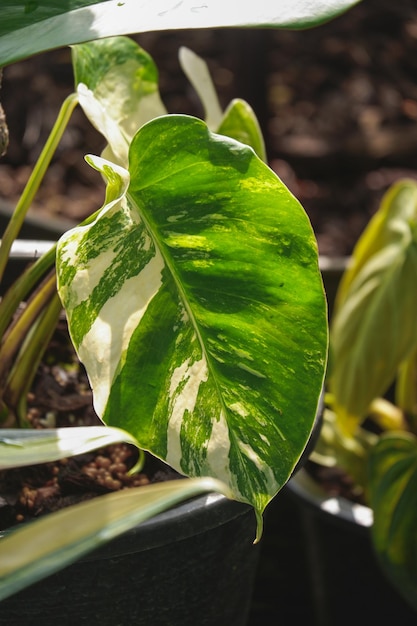
The width and height of the screenshot is (417, 626). I want to click on blank empty space between vases, so (283, 565).